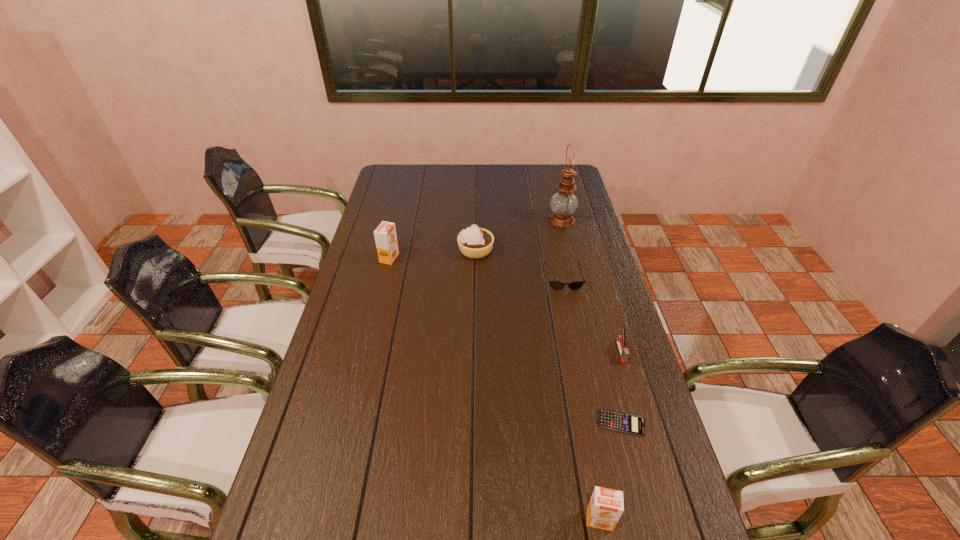
The width and height of the screenshot is (960, 540). I want to click on vacant space situated on the back of the shortest object, so click(599, 335).

Find the location of `object present at the near edge`. object present at the near edge is located at coordinates (606, 506).

This screenshot has height=540, width=960. Identify the location of object that is positioned at the left edge. (385, 235).

Where is `oil lamp at the right edge`? oil lamp at the right edge is located at coordinates (563, 203).

At what (x,y) coordinates should I click in order to perform the action: click on sunglasses that is at the right edge. Please return your answer as a coordinate pair (x, y). The width and height of the screenshot is (960, 540). Looking at the image, I should click on pyautogui.click(x=556, y=285).

Find the location of a particular element. The height and width of the screenshot is (540, 960). stapler that is at the right edge is located at coordinates (620, 340).

This screenshot has height=540, width=960. I want to click on calculator located at the right edge, so click(x=623, y=422).

The image size is (960, 540). I want to click on free space at the far edge of the desktop, so click(x=527, y=180).

Find the location of a particular element. Image resolution: width=960 pixels, height=540 pixels. vacant space at the near edge is located at coordinates (536, 523).

I want to click on free point at the left edge, so click(315, 430).